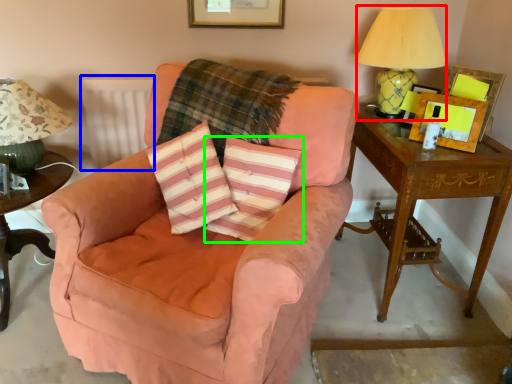
Question: Which object is positioned closest to table lamp (highlighted by a red box)? Select from radiator (highlighted by a blue box) and pillow (highlighted by a green box).

Choices:
 (A) radiator
 (B) pillow

Answer: (B)